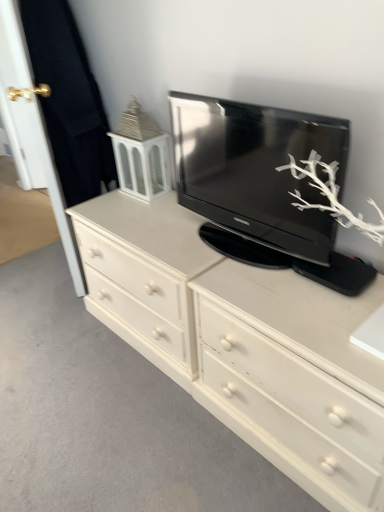
Question: From a real-world perspective, is white painted wood chest of drawers at center physically below gold metallic door handle at upper left, which is counted as the second door, starting from the right?

Choices:
 (A) no
 (B) yes

Answer: (B)

Question: Are white painted wood chest of drawers at center and gold metallic door handle at upper left, which is counted as the second door, starting from the right, far apart?

Choices:
 (A) yes
 (B) no

Answer: (A)

Question: Does white painted wood chest of drawers at center appear on the left side of gold metallic door handle at upper left, which is counted as the second door, starting from the right?

Choices:
 (A) no
 (B) yes

Answer: (A)

Question: Is white painted wood chest of drawers at center to the right of gold metallic door handle at upper left, which is counted as the second door, starting from the right, from the viewer's perspective?

Choices:
 (A) yes
 (B) no

Answer: (A)

Question: Considering the relative sizes of white painted wood chest of drawers at center and gold metallic door handle at upper left, which is counted as the second door, starting from the right, in the image provided, is white painted wood chest of drawers at center taller than gold metallic door handle at upper left, which is counted as the second door, starting from the right,?

Choices:
 (A) no
 (B) yes

Answer: (A)

Question: From the image's perspective, does white painted wood chest of drawers at center appear higher than gold metallic door handle at upper left, which is counted as the second door, starting from the right?

Choices:
 (A) no
 (B) yes

Answer: (A)

Question: From the image's perspective, would you say white painted wood tv cabinet at upper left is positioned over white wood door at left, arranged as the second door when viewed from the left?

Choices:
 (A) no
 (B) yes

Answer: (A)

Question: Does white painted wood tv cabinet at upper left appear on the right side of white wood door at left, arranged as the second door when viewed from the left?

Choices:
 (A) yes
 (B) no

Answer: (A)

Question: Is white painted wood tv cabinet at upper left outside of white wood door at left, which is counted as the first door, starting from the right?

Choices:
 (A) yes
 (B) no

Answer: (A)

Question: From the image's perspective, is white painted wood tv cabinet at upper left beneath white wood door at left, arranged as the second door when viewed from the left?

Choices:
 (A) yes
 (B) no

Answer: (A)

Question: Can you confirm if white painted wood tv cabinet at upper left is bigger than white wood door at left, which is counted as the first door, starting from the right?

Choices:
 (A) no
 (B) yes

Answer: (A)

Question: Does white painted wood tv cabinet at upper left appear on the left side of white wood door at left, arranged as the second door when viewed from the left?

Choices:
 (A) no
 (B) yes

Answer: (A)

Question: Can you confirm if white painted wood tv cabinet at upper left is taller than white matte drawer at center?

Choices:
 (A) yes
 (B) no

Answer: (B)